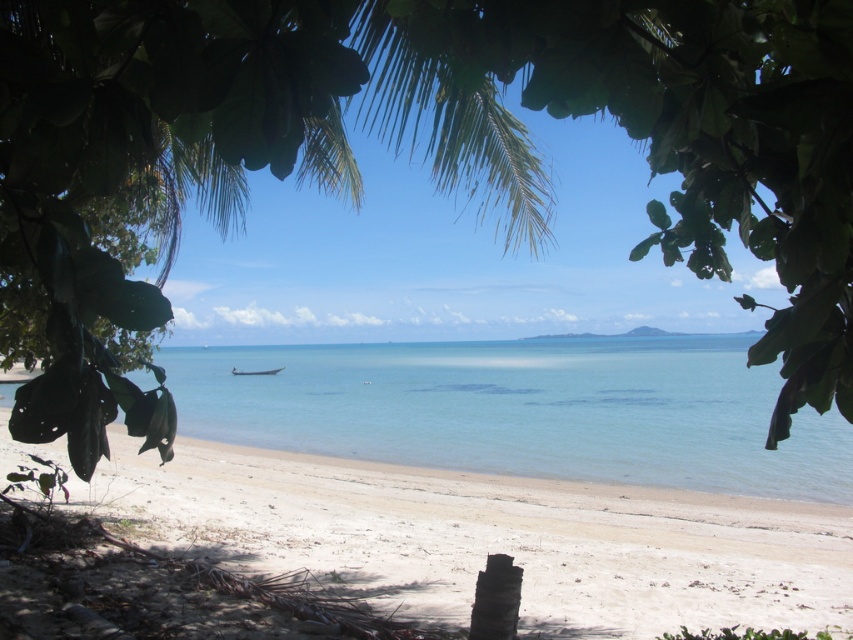
You are standing on the white sandy beach at lower center and want to walk towards the clear blue water at center. Which direction should you move to get closer to the water?

Since the white sandy beach at lower center is further to the viewer than the clear blue water at center, you should move forward towards the water to get closer.

You are standing at the beach and want to locate two points marked in the image. Which of the two points, point (378, 403) or point (245, 372), is nearer to your current position?

Point (378, 403) is closer to the camera than point (245, 372), so it is nearer to your current position.

You are standing on the beach and see two points marked in the image. The first point is at coordinates point (793, 516) and the second is at point (677, 449). Which point is closer to you?

Point (793, 516) is closer to the viewer than point (677, 449).